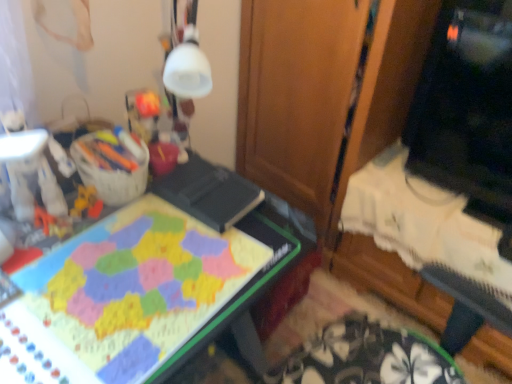
This screenshot has width=512, height=384. What are the coordinates of `blank space to the left of black glossy monitor at upper right` in the screenshot? It's located at (396, 196).